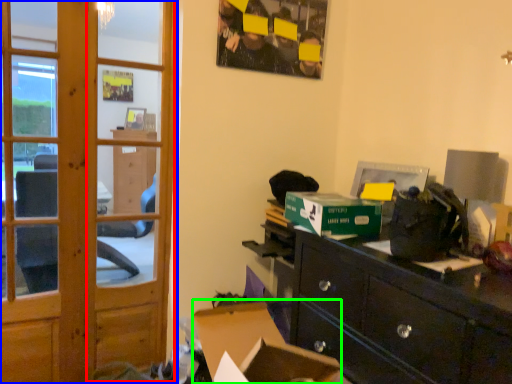
Question: Considering the real-world distances, which object is farthest from screen door (highlighted by a red box)? door (highlighted by a blue box) or computer desk (highlighted by a green box)?

Choices:
 (A) door
 (B) computer desk

Answer: (B)